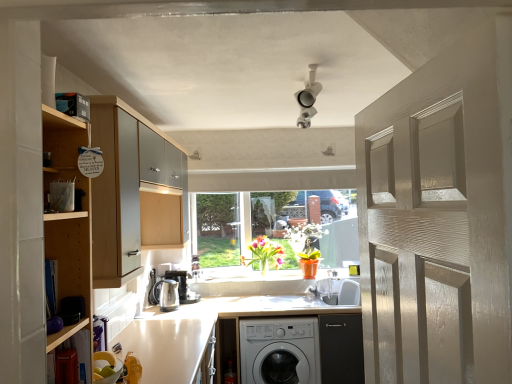
The height and width of the screenshot is (384, 512). I want to click on matte white door at right, so 439,217.

I want to click on wooden cabinet at left, placed as the 2th cabinetry when sorted from front to back, so click(x=134, y=191).

Locate an element on the screen. The width and height of the screenshot is (512, 384). wooden shelf at left, acting as the second cabinetry starting from the back is located at coordinates (68, 223).

Describe the element at coordinates (182, 286) in the screenshot. The height and width of the screenshot is (384, 512). I see `satin silver kettle at center, arranged as the 2th appliance when viewed from the front` at that location.

Identify the location of matte white door at right. This screenshot has height=384, width=512. (439, 217).

Is matte white door at right turned away from wooden shelf at left, acting as the second cabinetry starting from the back?

No, wooden shelf at left, acting as the second cabinetry starting from the back, is not at the back of matte white door at right.

Is matte white door at right at the right side of wooden shelf at left, which appears as the 1th cabinetry when viewed from the front?

Indeed, matte white door at right is positioned on the right side of wooden shelf at left, which appears as the 1th cabinetry when viewed from the front.

Who is taller, matte white door at right or wooden shelf at left, which appears as the 1th cabinetry when viewed from the front?

Standing taller between the two is matte white door at right.

Is white matte washing machine at lower center in contact with wooden shelf at lower left?

No, white matte washing machine at lower center is not with wooden shelf at lower left.

Is white matte washing machine at lower center behind wooden shelf at lower left?

Yes, the depth of white matte washing machine at lower center is greater than that of wooden shelf at lower left.

Which is more to the right, white matte washing machine at lower center or wooden shelf at lower left?

Positioned to the right is white matte washing machine at lower center.

Could you tell me if white matte washing machine at lower center is facing wooden shelf at lower left?

Yes, white matte washing machine at lower center is oriented towards wooden shelf at lower left.

Is white matte washing machine at lower center surrounding white glossy countertop at lower center?

Definitely not — white glossy countertop at lower center is not inside white matte washing machine at lower center.

From a real-world perspective, which is physically above, white matte washing machine at lower center or white glossy countertop at lower center?

white glossy countertop at lower center.

Does white matte washing machine at lower center turn towards white glossy countertop at lower center?

No, white matte washing machine at lower center is not oriented towards white glossy countertop at lower center.

Based on the photo, considering the positions of objects wooden shelf at left, which appears as the 1th cabinetry when viewed from the front, and wooden cabinet at left, the 1th cabinetry when ordered from back to front, in the image provided, who is more to the right, wooden shelf at left, which appears as the 1th cabinetry when viewed from the front, or wooden cabinet at left, the 1th cabinetry when ordered from back to front,?

Positioned to the right is wooden shelf at left, which appears as the 1th cabinetry when viewed from the front.

Find the location of a particular element. cabinetry behind the wooden shelf at left, acting as the second cabinetry starting from the back is located at coordinates (134, 191).

Is wooden shelf at left, which appears as the 1th cabinetry when viewed from the front, not close to wooden cabinet at left, the 1th cabinetry when ordered from back to front?

No.

Could you tell me if wooden shelf at left, which appears as the 1th cabinetry when viewed from the front, is turned towards wooden cabinet at left, placed as the 2th cabinetry when sorted from front to back?

No, wooden shelf at left, which appears as the 1th cabinetry when viewed from the front, does not turn towards wooden cabinet at left, placed as the 2th cabinetry when sorted from front to back.

From a real-world perspective, is wooden shelf at left, which appears as the 1th cabinetry when viewed from the front, positioned over orange matte pot at center, which is counted as the second plant, starting from the left, based on gravity?

Indeed, from a real-world perspective, wooden shelf at left, which appears as the 1th cabinetry when viewed from the front, stands above orange matte pot at center, which is counted as the second plant, starting from the left.

Could you tell me if wooden shelf at left, which appears as the 1th cabinetry when viewed from the front, is facing orange matte pot at center, the first plant in the right-to-left sequence?

No.

Is point (74, 144) farther from camera compared to point (294, 249)?

No, (74, 144) is in front of (294, 249).

From the orange matte pot at center, which is counted as the second plant, starting from the left, count 2nd cabinetrys forward and point to it. Please provide its 2D coordinates.

[(68, 223)]

Locate an element on the screen. The height and width of the screenshot is (384, 512). the 1st appliance positioned below the wooden shelf at lower left (from a real-world perspective) is located at coordinates (182, 286).

Which is behind, satin silver kettle at center, arranged as the 2th appliance when viewed from the front, or wooden shelf at lower left?

Positioned behind is satin silver kettle at center, arranged as the 2th appliance when viewed from the front.

Does satin silver kettle at center, arranged as the 2th appliance when viewed from the front, have a lesser width compared to wooden shelf at lower left?

No.

From the image's perspective, which one is positioned higher, satin silver kettle at center, which ranks as the 1th appliance in back-to-front order, or wooden shelf at lower left?

wooden shelf at lower left.

Is satin silver kettle at center, arranged as the 2th appliance when viewed from the front, inside the boundaries of white glossy countertop at lower center, or outside?

satin silver kettle at center, arranged as the 2th appliance when viewed from the front, cannot be found inside white glossy countertop at lower center.

From the image's perspective, which object appears higher, satin silver kettle at center, which ranks as the 1th appliance in back-to-front order, or white glossy countertop at lower center?

satin silver kettle at center, which ranks as the 1th appliance in back-to-front order, appears higher in the image.

The height and width of the screenshot is (384, 512). Identify the location of the 1st appliance to the left of the white glossy countertop at lower center, starting your count from the anchor. (182, 286).

Visually, is satin silver kettle at center, arranged as the 2th appliance when viewed from the front, positioned to the left or to the right of white glossy countertop at lower center?

satin silver kettle at center, arranged as the 2th appliance when viewed from the front, is positioned on white glossy countertop at lower center's left side.

What are the coordinates of `door above the wooden shelf at left, which appears as the 1th cabinetry when viewed from the front (from the image's perspective)` in the screenshot? It's located at (439, 217).

Find the location of `shelf on the left of the white matte washing machine at lower center`. shelf on the left of the white matte washing machine at lower center is located at coordinates (70, 349).

Which object lies further to the anchor point wooden shelf at lower left, white glossy countertop at lower center or wooden shelf at left, acting as the second cabinetry starting from the back?

white glossy countertop at lower center is further to wooden shelf at lower left.

When comparing their distances from wooden cabinet at left, the 1th cabinetry when ordered from back to front, does wooden shelf at lower left or white matte washing machine at lower center seem closer?

The object closer to wooden cabinet at left, the 1th cabinetry when ordered from back to front, is wooden shelf at lower left.

When comparing their distances from orange matte pot at center, which is counted as the second plant, starting from the left, does white matte washing machine at lower center or white glossy countertop at lower center seem closer?

white matte washing machine at lower center lies closer to orange matte pot at center, which is counted as the second plant, starting from the left, than the other object.

Based on the photo, considering their positions, is satin silver kettle at lower left, positioned as the first appliance in front-to-back order, positioned closer to translucent glass vase at center, arranged as the second plant when viewed from the right, than wooden shelf at lower left?

Based on the image, satin silver kettle at lower left, positioned as the first appliance in front-to-back order, appears to be nearer to translucent glass vase at center, arranged as the second plant when viewed from the right.

Looking at the image, which one is located closer to satin silver kettle at lower left, positioned as the first appliance in front-to-back order, satin silver kettle at center, arranged as the 2th appliance when viewed from the front, or white matte washing machine at lower center?

satin silver kettle at center, arranged as the 2th appliance when viewed from the front.

Estimate the real-world distances between objects in this image. Which object is further from matte white door at right, satin silver kettle at lower left, placed as the second appliance when sorted from back to front, or wooden cabinet at left, placed as the 2th cabinetry when sorted from front to back?

satin silver kettle at lower left, placed as the second appliance when sorted from back to front, is positioned further to the anchor matte white door at right.

Considering their positions, is white glossy countertop at lower center positioned further to wooden shelf at left, which appears as the 1th cabinetry when viewed from the front, than translucent glass vase at center, arranged as the second plant when viewed from the right?

translucent glass vase at center, arranged as the second plant when viewed from the right, lies further to wooden shelf at left, which appears as the 1th cabinetry when viewed from the front, than the other object.

Considering their positions, is wooden shelf at left, acting as the second cabinetry starting from the back, positioned closer to satin silver kettle at center, which ranks as the 1th appliance in back-to-front order, than wooden shelf at lower left?

Among the two, wooden shelf at lower left is located nearer to satin silver kettle at center, which ranks as the 1th appliance in back-to-front order.

Identify the location of counter top between matte white door at right and orange matte pot at center, the first plant in the right-to-left sequence, from front to back. (168, 345).

Where is `appliance between satin silver kettle at lower left, positioned as the first appliance in front-to-back order, and translucent glass vase at center, arranged as the 1th plant when viewed from the left`? This screenshot has width=512, height=384. appliance between satin silver kettle at lower left, positioned as the first appliance in front-to-back order, and translucent glass vase at center, arranged as the 1th plant when viewed from the left is located at coordinates (182, 286).

The width and height of the screenshot is (512, 384). I want to click on counter top positioned between wooden cabinet at left, the 1th cabinetry when ordered from back to front, and translucent glass vase at center, arranged as the second plant when viewed from the right, from near to far, so click(x=168, y=345).

Where is `washing machine positioned between wooden shelf at lower left and translucent glass vase at center, arranged as the 1th plant when viewed from the left, from near to far`? The height and width of the screenshot is (384, 512). washing machine positioned between wooden shelf at lower left and translucent glass vase at center, arranged as the 1th plant when viewed from the left, from near to far is located at coordinates (280, 351).